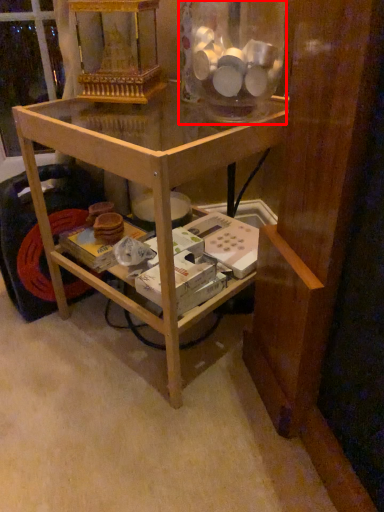
Question: Where is glass jar (annotated by the red box) located in relation to table in the image?

Choices:
 (A) right
 (B) left

Answer: (A)